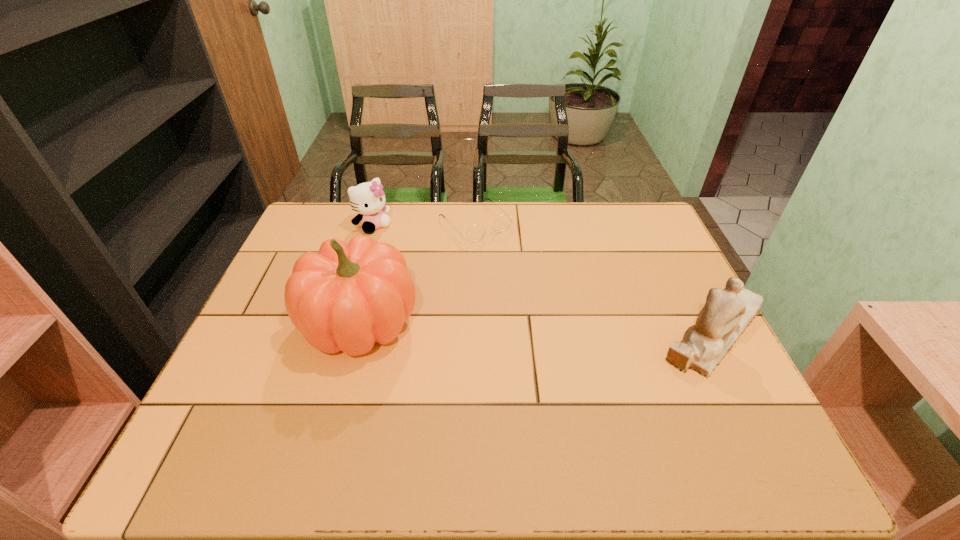
The image size is (960, 540). In order to click on free space on the desktop that is between the pumpkin and the rightmost object and is positioned on the front-facing side of the shortest object in this screenshot , I will do `click(587, 328)`.

Find the location of a particular element. vacant space on the desktop that is between the pumpkin and the rightmost object and is positioned on the front-facing side of the kitten is located at coordinates (483, 325).